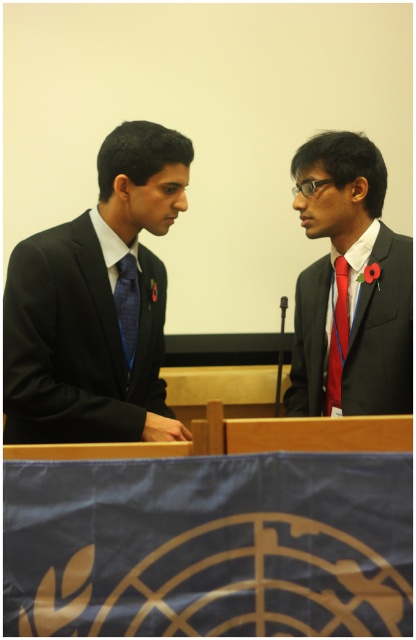
Question: Can you confirm if matte black suit at left is positioned below matte black suit at center?

Choices:
 (A) yes
 (B) no

Answer: (A)

Question: Which object is positioned farthest from the matte black suit at left?

Choices:
 (A) matte black suit at center
 (B) blue satin tie at left

Answer: (A)

Question: Is matte black suit at center positioned before red satin tie at right?

Choices:
 (A) no
 (B) yes

Answer: (B)

Question: Which object is the closest to the red satin tie at right?

Choices:
 (A) matte black suit at center
 (B) blue satin tie at left

Answer: (A)

Question: Is matte black suit at left bigger than matte black suit at center?

Choices:
 (A) no
 (B) yes

Answer: (B)

Question: Which of the following is the closest to the observer?

Choices:
 (A) red satin tie at right
 (B) matte black suit at center

Answer: (B)